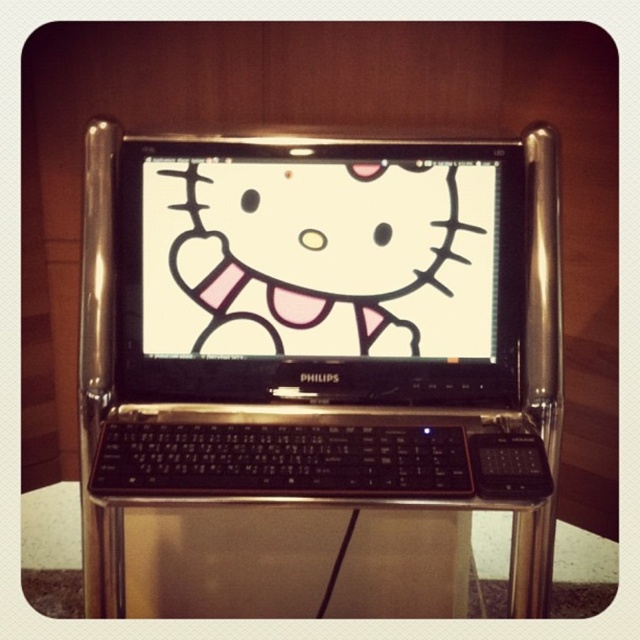
You are looking at the computer setup from the front. There are two points marked on the image, point 1 at coordinates point (339, 308) and point 2 at coordinates point (429, 204). Which point is closer to you?

Point (339, 308) is closer to the camera than point (429, 204), so point 1 is closer to you.

You are standing in front of the computer setup and want to reach the point at coordinates point (147, 337). If your hand can extend 1.1 meters forward, can you reach it?

The point (147, 337) is 1.17 meters away from the camera, so your hand can only extend 1.1 meters, meaning you cannot reach it.

You are a technician measuring the space between two components on a portable computer setup. You need to know if there is enough room to place a 3 inch wide cable between the black plastic laptop at center and the matte white face at center. Based on the image, can the cable fit?

The distance between the black plastic laptop at center and the matte white face at center is 2.63 inches. Since the cable is 3 inches wide, it will not fit in the available space.